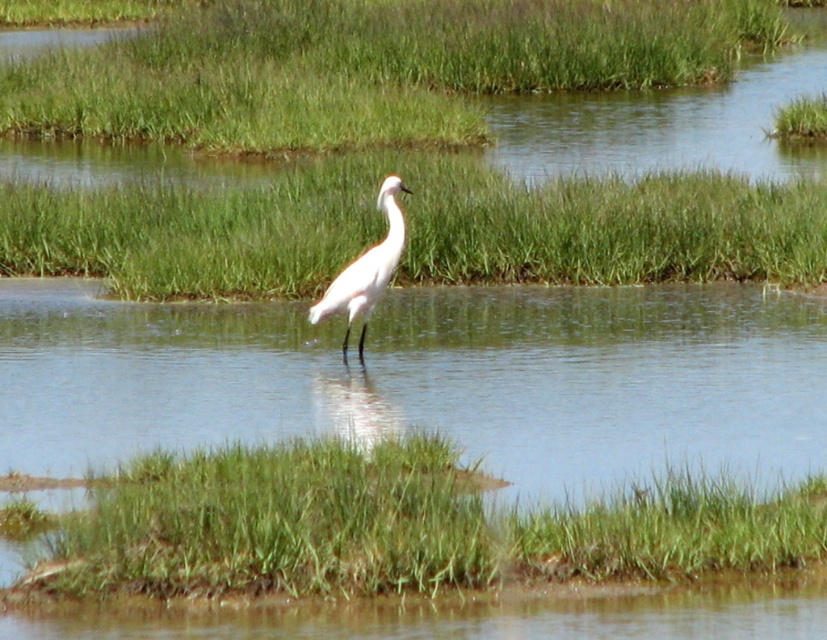
Question: Does green grassy at lower center appear on the left side of white matte bird at center?

Choices:
 (A) no
 (B) yes

Answer: (A)

Question: Which object appears closest to the camera in this image?

Choices:
 (A) green grass at center
 (B) green grassy at lower center

Answer: (B)

Question: Which point is farther to the camera?

Choices:
 (A) green grassy at lower center
 (B) green grass at center

Answer: (B)

Question: Does green grass at center have a greater width compared to white matte bird at center?

Choices:
 (A) yes
 (B) no

Answer: (B)

Question: Is green grassy at lower center bigger than white matte bird at center?

Choices:
 (A) yes
 (B) no

Answer: (A)

Question: Among these objects, which one is nearest to the camera?

Choices:
 (A) green grassy at lower center
 (B) white matte bird at center
 (C) green grass at center

Answer: (A)